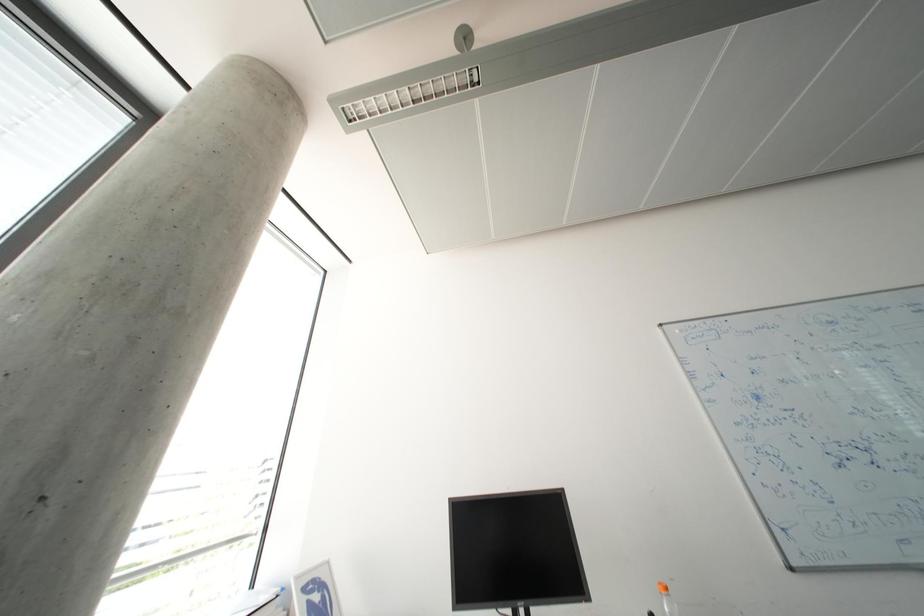
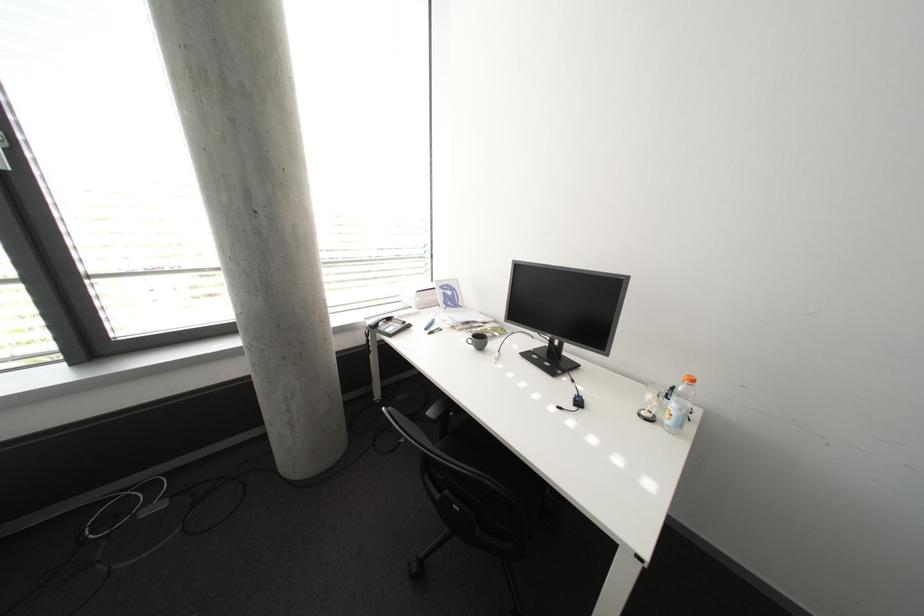
How did the camera likely rotate?

The camera's rotation is toward left-down.